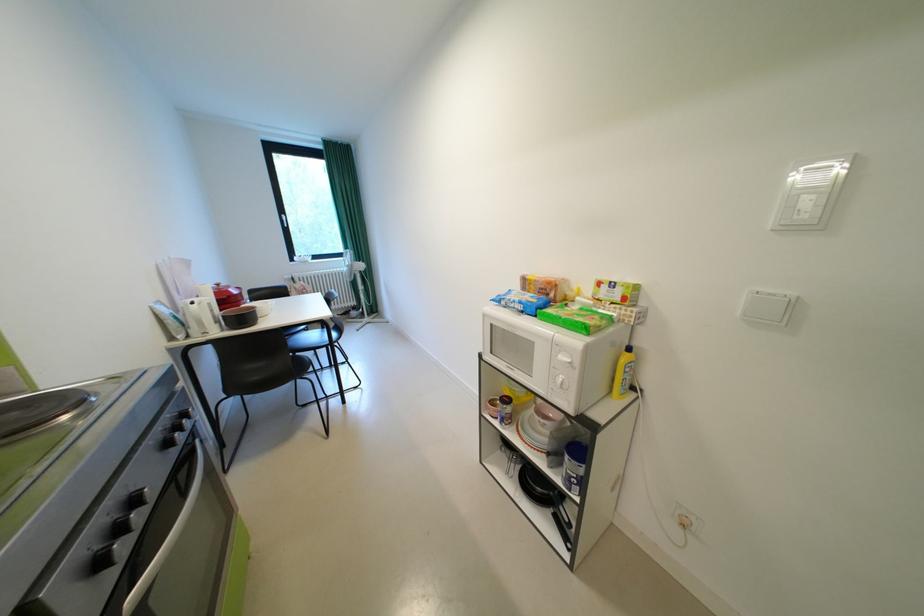
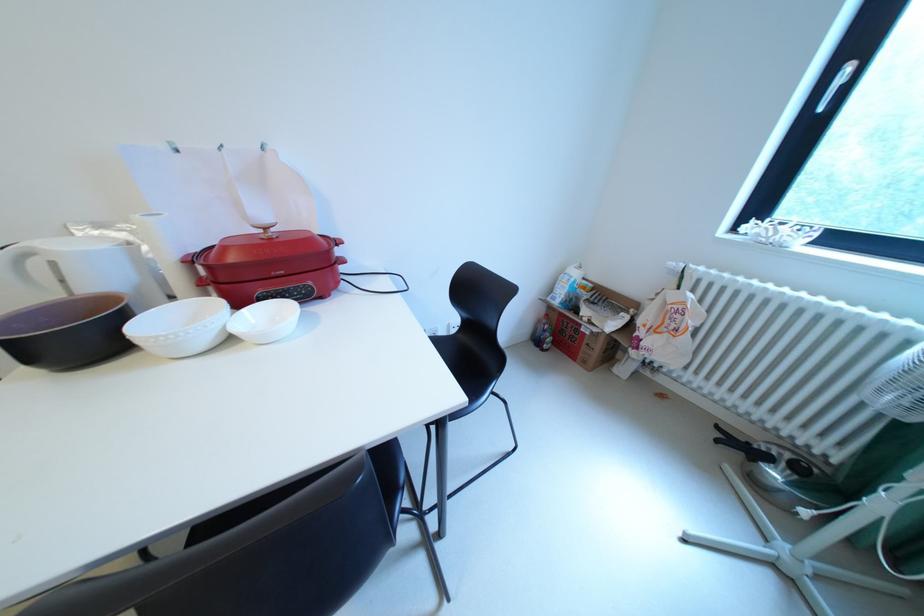
Question: I am providing you with two images of the same scene from different viewpoints. Please identify which objects are invisible in image2.

Choices:
 (A) red pot side handle
 (B) black chair sitting surface
 (C) pot lid handle
 (D) none of these

Answer: (D)